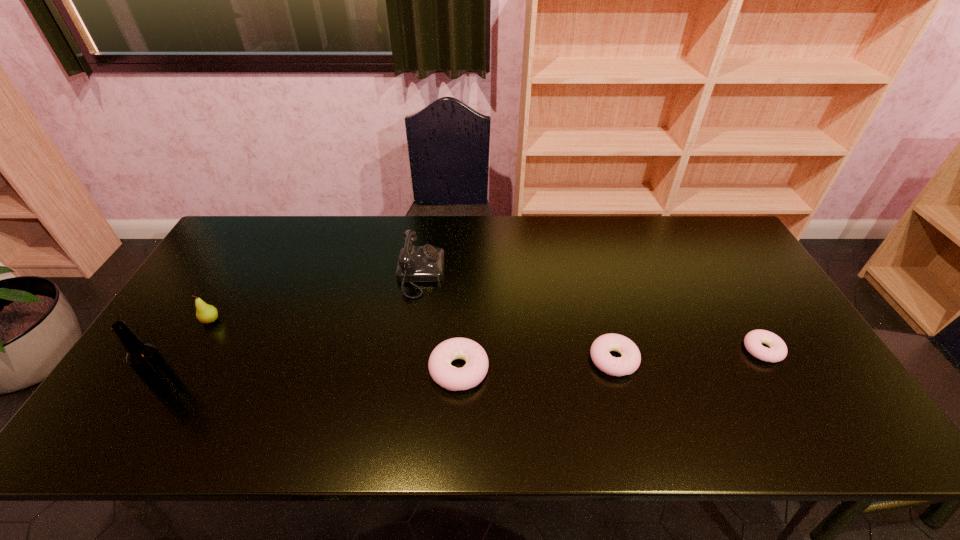
Observe the arrangement of all doughnuts in the image. To keep them evenly spaced, where would you place another doughnut on the left? Please locate a free space. Please provide its 2D coordinates. Your answer should be formatted as a tuple, i.e. [(x, y)], where the tuple contains the x and y coordinates of a point satisfying the conditions above.

[(298, 380)]